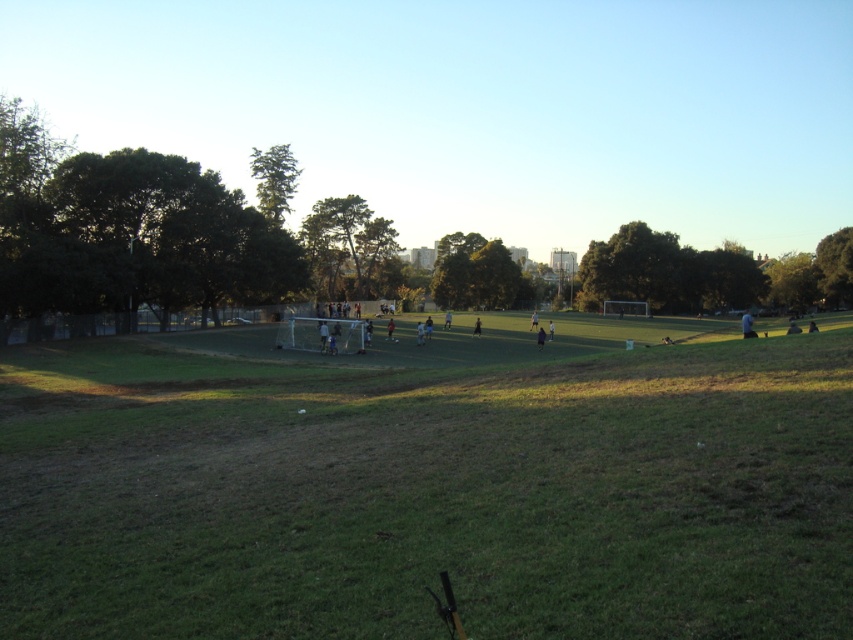
You are a soccer coach observing the field. You notice a dark blue jersey at center and a black fabric person at center. Which object appears smaller in the image?

The dark blue jersey at center appears smaller than the black fabric person at center.

You are a soccer coach observing the field. You notice a player wearing a light blue shirt at center. Where exactly is this player positioned on the field? Provide the coordinates as a point in the format like point (x=747, y=324).

The light blue shirt at center is located at point (x=747, y=324).

You are a referee observing the soccer match. You notice two players in the center of the field wearing light blue shirt at center and dark blue jersey at center. Which player is standing closer to the referee?

The light blue shirt at center is taller than the dark blue jersey at center, so the light blue shirt at center is closer to the referee because objects that are closer appear larger.